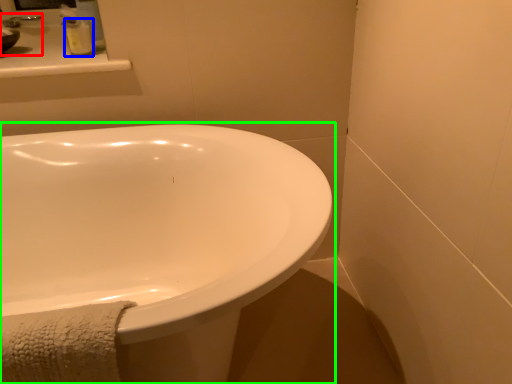
Question: Which is farther away from sink (highlighted by a red box)? soap dispenser (highlighted by a blue box) or bathtub (highlighted by a green box)?

Choices:
 (A) soap dispenser
 (B) bathtub

Answer: (B)